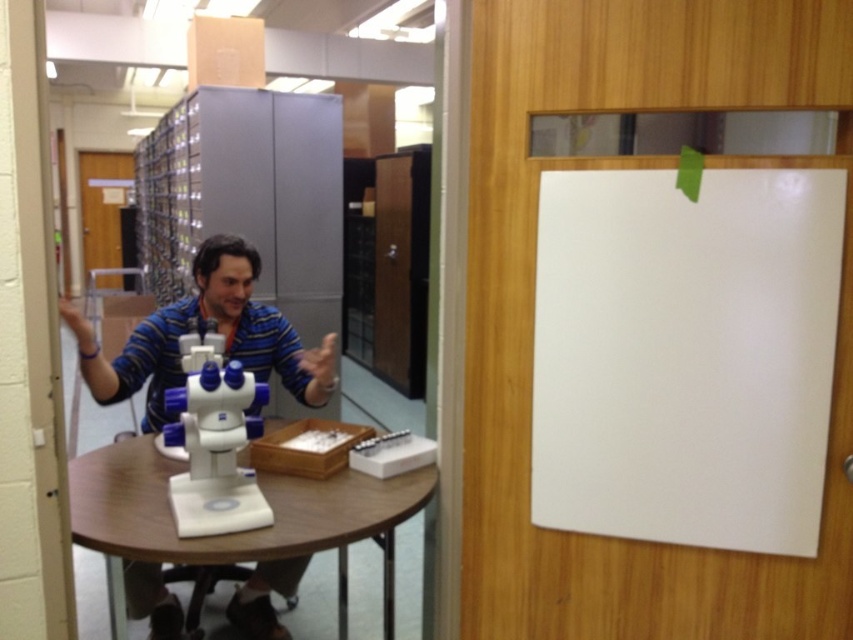
Does white matte board at upper right have a larger size compared to white plastic microscope at center?

Correct, white matte board at upper right is larger in size than white plastic microscope at center.

Looking at this image, can you confirm if white matte board at upper right is positioned to the left of white plastic microscope at center?

No, white matte board at upper right is not to the left of white plastic microscope at center.

Identify the location of white matte board at upper right. The image size is (853, 640). (685, 355).

Find the location of a particular element. The image size is (853, 640). white matte board at upper right is located at coordinates (685, 355).

Who is shorter, white plastic round table at center or blue plastic microscope at center?

With less height is blue plastic microscope at center.

Is white plastic round table at center smaller than blue plastic microscope at center?

Incorrect, white plastic round table at center is not smaller in size than blue plastic microscope at center.

Which is in front, point (283, 547) or point (316, 388)?

Point (283, 547)

Locate an element on the screen. The height and width of the screenshot is (640, 853). white plastic round table at center is located at coordinates (236, 532).

Does point (254, 614) come closer to viewer compared to point (234, 468)?

That is False.

How much distance is there between blue plastic microscope at center and white plastic microscope at center?

blue plastic microscope at center and white plastic microscope at center are 15.27 inches apart from each other.

Describe the element at coordinates (202, 332) in the screenshot. I see `blue plastic microscope at center` at that location.

Find the location of a particular element. blue plastic microscope at center is located at coordinates (202, 332).